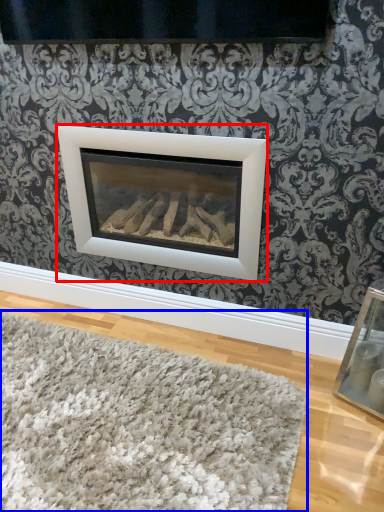
Question: Among these objects, which one is farthest to the camera, fireplace (highlighted by a red box) or mat (highlighted by a blue box)?

Choices:
 (A) fireplace
 (B) mat

Answer: (A)